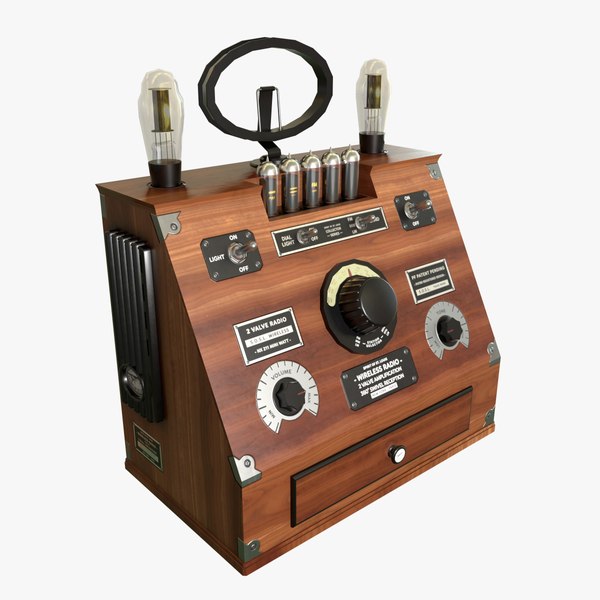
At what (x,y) coordinates should I click in order to perform the action: click on dial light switch. Please return your answer as a coordinate pair (x, y). This screenshot has height=600, width=600. Looking at the image, I should click on (304, 235).